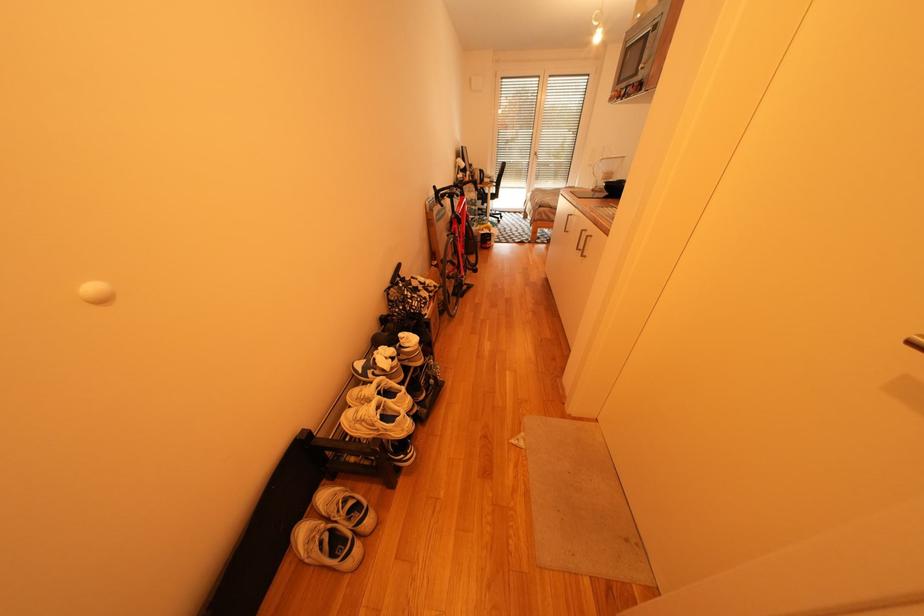
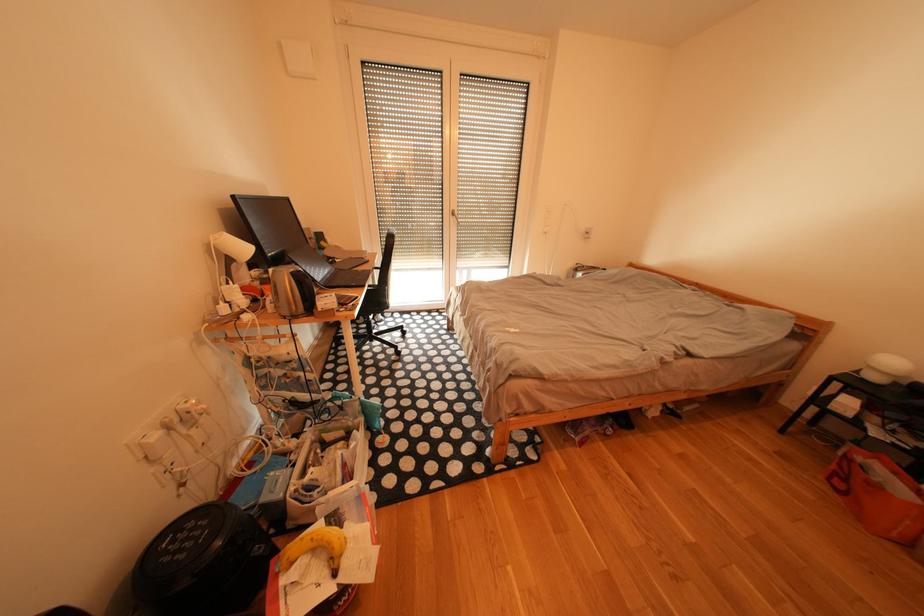
Question: The images are taken continuously from a first-person perspective. In which direction are you moving?

Choices:
 (A) Left
 (B) Right
 (C) Forward
 (D) Backward

Answer: (C)